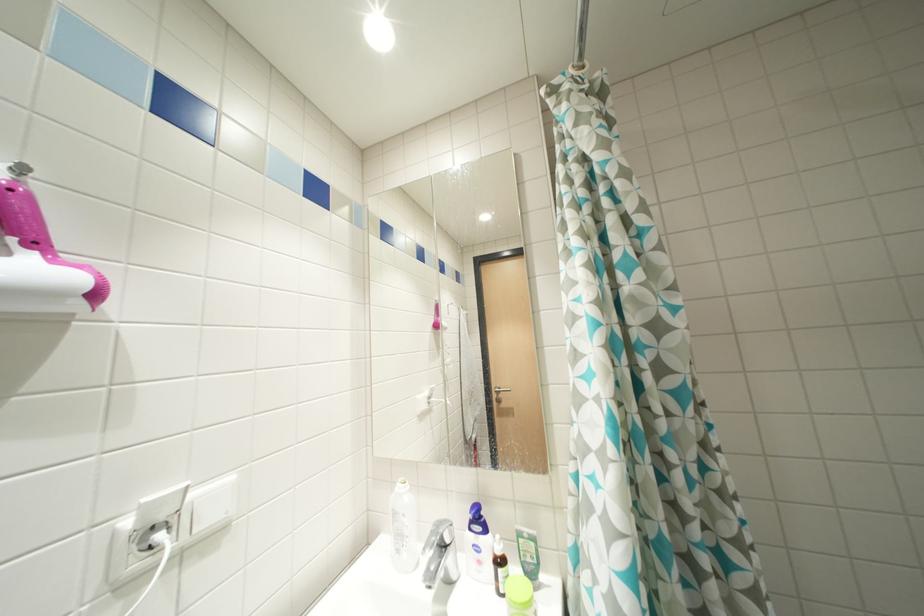
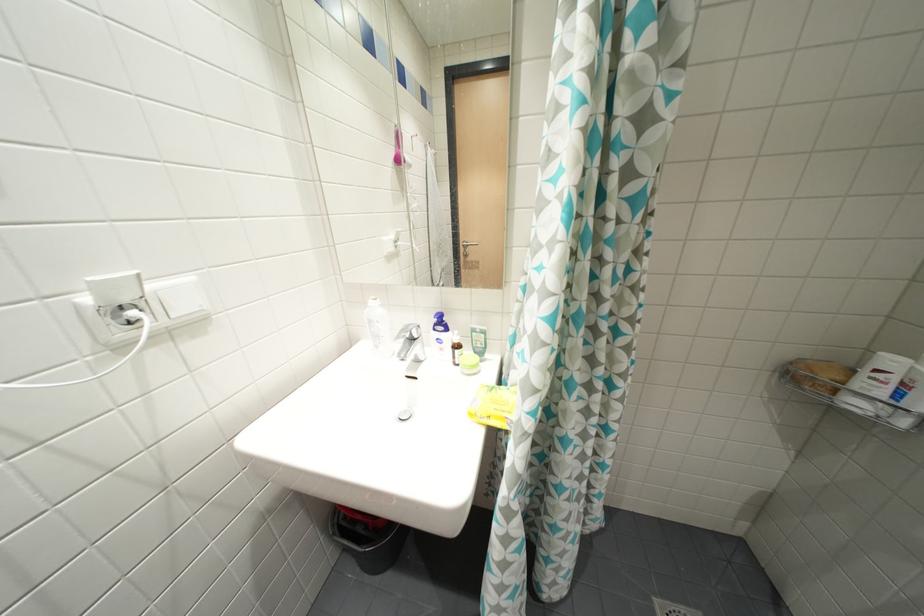
Question: The images are taken continuously from a first-person perspective. In which direction is your viewpoint rotating?

Choices:
 (A) Left
 (B) Right
 (C) Up
 (D) Down

Answer: (D)